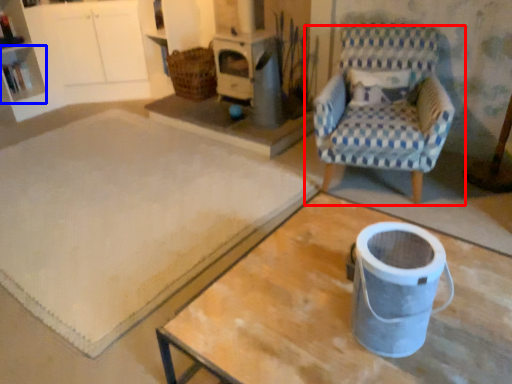
Question: Which point is closer to the camera, chair (highlighted by a red box) or shelf (highlighted by a blue box)?

Choices:
 (A) chair
 (B) shelf

Answer: (A)